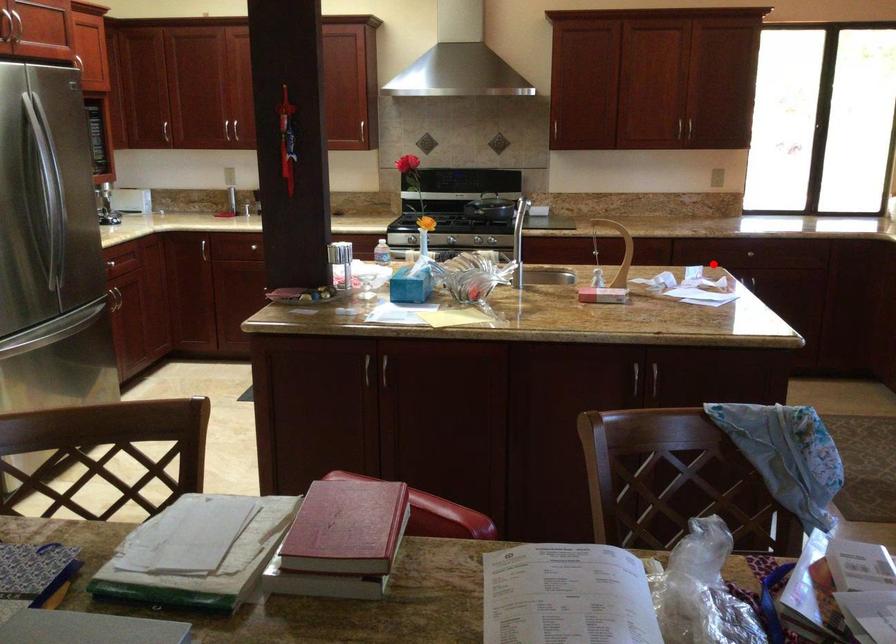
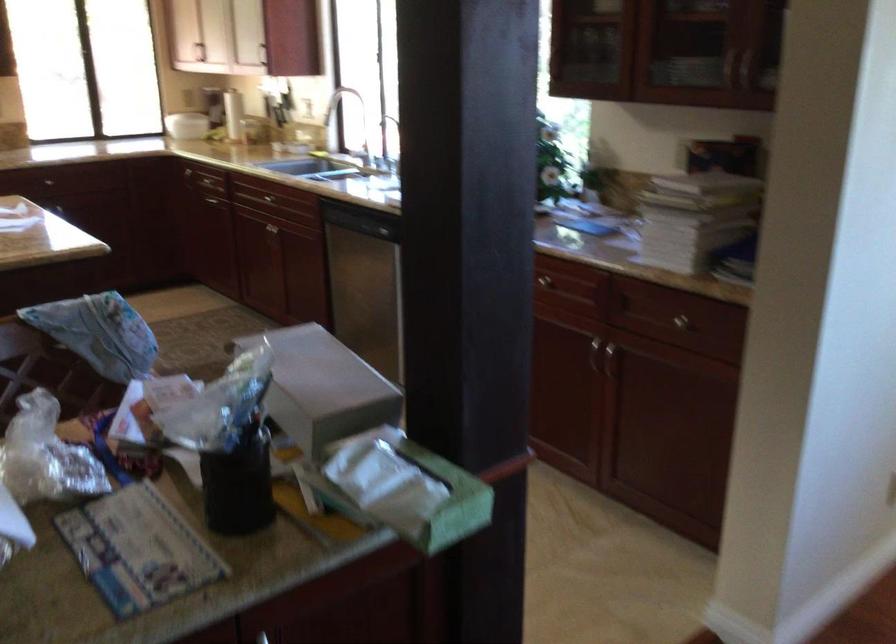
In the second image, find the point that corresponds to the highlighted location in the first image.

(65, 207)